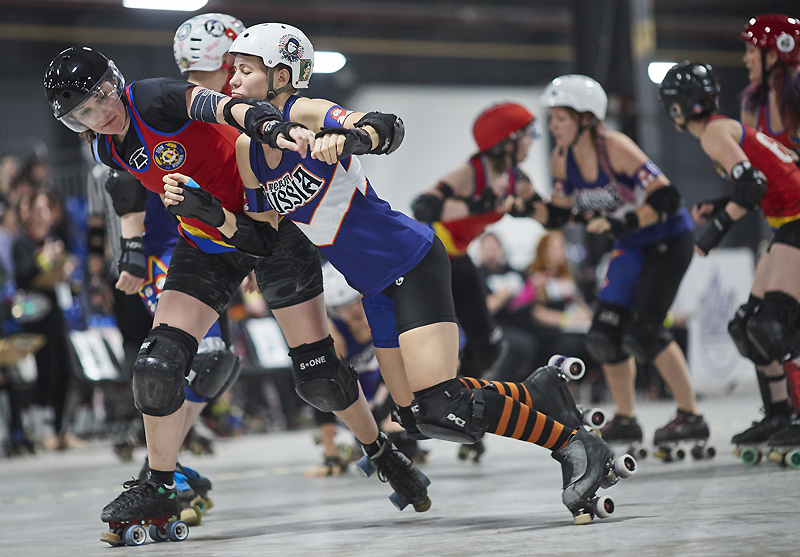
I want to click on light, so click(169, 1), click(325, 60), click(657, 72).